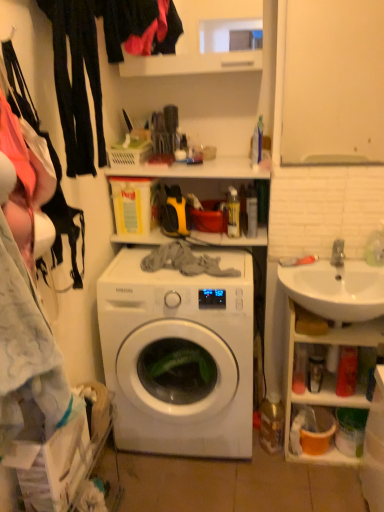
What do you see at coordinates (326, 378) in the screenshot? The width and height of the screenshot is (384, 512). I see `white glossy sink at lower right` at bounding box center [326, 378].

At what (x,y) coordinates should I click in order to perform the action: click on white ceramic sink at right. Please return your answer as a coordinate pair (x, y). This screenshot has height=512, width=384. Looking at the image, I should click on (335, 287).

Find the location of a particular element. This screenshot has height=512, width=384. white glossy sink at lower right is located at coordinates (326, 378).

Is white glossy sink at lower right oriented towards matte black fabric at upper left?

No, white glossy sink at lower right does not turn towards matte black fabric at upper left.

Is white glossy sink at lower right wider than matte black fabric at upper left?

No, white glossy sink at lower right is not wider than matte black fabric at upper left.

Can you confirm if white glossy sink at lower right is positioned to the left of matte black fabric at upper left?

No, white glossy sink at lower right is not to the left of matte black fabric at upper left.

Between point (329, 335) and point (146, 16), which one is positioned in front?

The point (146, 16) is closer to the camera.

Can you tell me how much matte black fabric at upper left and white glossy washing machine at center differ in facing direction?

The angle between the facing direction of matte black fabric at upper left and the facing direction of white glossy washing machine at center is 89.2 degrees.

Considering the relative sizes of matte black fabric at upper left and white glossy washing machine at center in the image provided, is matte black fabric at upper left bigger than white glossy washing machine at center?

Actually, matte black fabric at upper left might be smaller than white glossy washing machine at center.

Between matte black fabric at upper left and white glossy washing machine at center, which one is positioned in front?

Positioned in front is matte black fabric at upper left.

Is matte black fabric at upper left wider or thinner than white glossy washing machine at center?

matte black fabric at upper left is thinner than white glossy washing machine at center.

Considering the sizes of objects white ceramic sink at right and white glossy washing machine at center in the image provided, who is taller, white ceramic sink at right or white glossy washing machine at center?

white glossy washing machine at center.

Who is bigger, white ceramic sink at right or white glossy washing machine at center?

white glossy washing machine at center is bigger.

Between white ceramic sink at right and white glossy washing machine at center, which one is positioned behind?

white glossy washing machine at center is further from the camera.

Is point (328, 283) more distant than point (155, 336)?

Yes, point (328, 283) is behind point (155, 336).

Based on the photo, which of these two, white ceramic sink at right or white glossy sink at lower right, is wider?

white ceramic sink at right is wider.

I want to click on cabinet below the white ceramic sink at right (from a real-world perspective), so click(x=326, y=378).

From the picture: Is matte black fabric at upper left directly adjacent to white ceramic sink at right?

matte black fabric at upper left and white ceramic sink at right are not in contact.

Considering the relative positions of matte black fabric at upper left and white ceramic sink at right in the image provided, is matte black fabric at upper left in front of white ceramic sink at right?

Yes, matte black fabric at upper left is in front of white ceramic sink at right.

Considering the sizes of objects matte black fabric at upper left and white ceramic sink at right in the image provided, who is wider, matte black fabric at upper left or white ceramic sink at right?

Wider between the two is white ceramic sink at right.

From the picture: Measure the distance between matte black fabric at upper left and white ceramic sink at right.

matte black fabric at upper left and white ceramic sink at right are 1.12 meters apart from each other.

From a real-world perspective, is white glossy sink at lower right positioned above or below white ceramic sink at right?

Clearly, from a real-world perspective, white glossy sink at lower right is below white ceramic sink at right.

Which point is more forward, (327, 379) or (310, 298)?

The point (310, 298) is closer to the camera.

Based on the photo, which of these two, white glossy sink at lower right or white ceramic sink at right, is bigger?

white glossy sink at lower right is bigger.

Is matte black fabric at upper left facing away from white glossy sink at lower right?

That's not correct — matte black fabric at upper left is not looking away from white glossy sink at lower right.

From the image's perspective, which one is positioned higher, matte black fabric at upper left or white glossy sink at lower right?

matte black fabric at upper left, from the image's perspective.

Is point (170, 18) farther from camera compared to point (325, 395)?

No.

Is matte black fabric at upper left in contact with white glossy sink at lower right?

matte black fabric at upper left and white glossy sink at lower right are clearly separated.

Where is `clothing above the white glossy sink at lower right (from the image's perspective)`? This screenshot has height=512, width=384. clothing above the white glossy sink at lower right (from the image's perspective) is located at coordinates point(139,27).

This screenshot has width=384, height=512. In order to click on washing machine directly beneath the matte black fabric at upper left (from a real-world perspective) in this screenshot , I will do `click(179, 356)`.

Estimate the real-world distances between objects in this image. Which object is further from matte black fabric at upper left, white ceramic sink at right or white glossy washing machine at center?

Among the two, white ceramic sink at right is located further to matte black fabric at upper left.

Based on the photo, based on their spatial positions, is matte black fabric at upper left or white glossy washing machine at center closer to white ceramic sink at right?

white glossy washing machine at center.

Considering their positions, is white glossy washing machine at center positioned further to white ceramic sink at right than white glossy sink at lower right?

white glossy washing machine at center is further to white ceramic sink at right.

Which object lies further to the anchor point white ceramic sink at right, white glossy sink at lower right or white glossy washing machine at center?

white glossy washing machine at center.

From the image, which object appears to be farther from matte black fabric at upper left, white glossy washing machine at center or white glossy sink at lower right?

white glossy sink at lower right.

Looking at the image, which one is located further to white glossy sink at lower right, white ceramic sink at right or white glossy washing machine at center?

The object further to white glossy sink at lower right is white glossy washing machine at center.

Which object lies further to the anchor point white glossy washing machine at center, white ceramic sink at right or matte black fabric at upper left?

Among the two, matte black fabric at upper left is located further to white glossy washing machine at center.

Based on their spatial positions, is matte black fabric at upper left or white glossy sink at lower right further from white glossy washing machine at center?

matte black fabric at upper left lies further to white glossy washing machine at center than the other object.

Where is `sink between matte black fabric at upper left and white glossy sink at lower right in the vertical direction`? sink between matte black fabric at upper left and white glossy sink at lower right in the vertical direction is located at coordinates (335, 287).

The width and height of the screenshot is (384, 512). In order to click on sink between white glossy washing machine at center and white glossy sink at lower right in this screenshot , I will do pyautogui.click(x=335, y=287).

Find the location of `washing machine between matte black fabric at upper left and white glossy sink at lower right vertically`. washing machine between matte black fabric at upper left and white glossy sink at lower right vertically is located at coordinates click(x=179, y=356).

The height and width of the screenshot is (512, 384). What are the coordinates of `sink between matte black fabric at upper left and white glossy washing machine at center from top to bottom` in the screenshot? It's located at (335, 287).